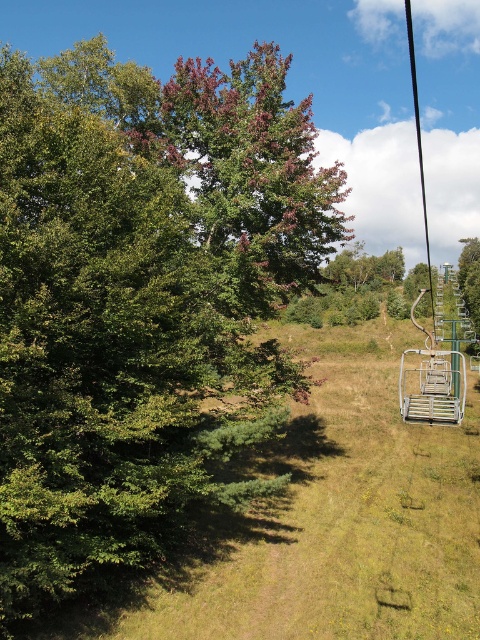
Looking at this image, is green leafy tree at upper left to the right of metallic silver ski lift at right from the viewer's perspective?

No, green leafy tree at upper left is not to the right of metallic silver ski lift at right.

Can you confirm if green leafy tree at upper left is positioned to the left of metallic silver ski lift at right?

Indeed, green leafy tree at upper left is positioned on the left side of metallic silver ski lift at right.

Which is behind, point (222, 80) or point (448, 422)?

Point (222, 80)

This screenshot has width=480, height=640. I want to click on green leafy tree at upper left, so click(x=142, y=298).

The width and height of the screenshot is (480, 640). Describe the element at coordinates (250, 176) in the screenshot. I see `green leafy tree at center` at that location.

Is green leafy tree at center taller than metallic silver ski lift at right?

No.

Is point (297, 202) farther from camera compared to point (432, 396)?

That is True.

You are a GUI agent. You are given a task and a screenshot of the screen. Output one action in this format:
    pyautogui.click(x=<x>, y=<y>)
    Task: Click on the green leafy tree at center
    Image resolution: width=480 pixels, height=640 pixels.
    Given the screenshot: What is the action you would take?
    [250, 176]

Is green leafy tree at upper left behind green leafy tree at center?

No, it is in front of green leafy tree at center.

Consider the image. Between green leafy tree at upper left and green leafy tree at center, which one has less height?

green leafy tree at center is shorter.

Is point (231, 81) closer to camera compared to point (295, 291)?

Yes, point (231, 81) is closer to viewer.

At what (x,y) coordinates should I click in order to perform the action: click on green leafy tree at upper left. Please return your answer as a coordinate pair (x, y). Image resolution: width=480 pixels, height=640 pixels. Looking at the image, I should click on (142, 298).